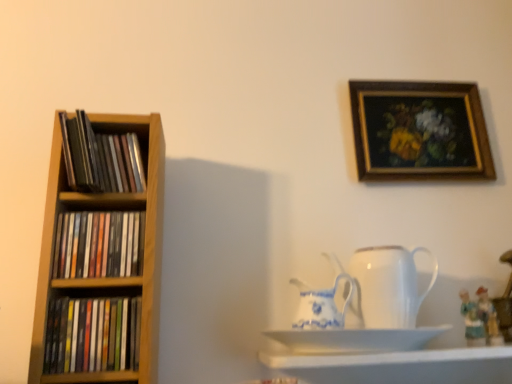
Question: Is matte ceramic figurine at lower right, which is the first toy in left-to-right order, oriented towards white porcelain jug at center, which is counted as the first jug, starting from the right?

Choices:
 (A) no
 (B) yes

Answer: (A)

Question: Is matte ceramic figurine at lower right, which is the first toy in left-to-right order, bigger than white porcelain jug at center, which is counted as the first jug, starting from the right?

Choices:
 (A) no
 (B) yes

Answer: (A)

Question: Does matte ceramic figurine at lower right, which is the second toy in right-to-left order, come behind white porcelain jug at center, positioned as the second jug in left-to-right order?

Choices:
 (A) no
 (B) yes

Answer: (B)

Question: Is matte ceramic figurine at lower right, which is the second toy in right-to-left order, shorter than white porcelain jug at center, which is counted as the first jug, starting from the right?

Choices:
 (A) yes
 (B) no

Answer: (A)

Question: From a real-world perspective, is matte ceramic figurine at lower right, which is the first toy in left-to-right order, physically below white porcelain jug at center, which is counted as the first jug, starting from the right?

Choices:
 (A) no
 (B) yes

Answer: (B)

Question: Based on their sizes in the image, would you say white glossy shelf at lower center is bigger or smaller than matte ceramic figurine at lower right, placed as the first toy when sorted from right to left?

Choices:
 (A) small
 (B) big

Answer: (B)

Question: Considering the positions of point (470, 382) and point (486, 324), is point (470, 382) closer or farther from the camera than point (486, 324)?

Choices:
 (A) farther
 (B) closer

Answer: (B)

Question: In terms of width, does white glossy shelf at lower center look wider or thinner when compared to matte ceramic figurine at lower right, which appears as the 2th toy when viewed from the left?

Choices:
 (A) wide
 (B) thin

Answer: (A)

Question: In the image, is white glossy shelf at lower center on the left side or the right side of matte ceramic figurine at lower right, which appears as the 2th toy when viewed from the left?

Choices:
 (A) right
 (B) left

Answer: (B)

Question: From the image's perspective, relative to white glossy shelf at lower center, is matte ceramic figurine at lower right, which appears as the 2th toy when viewed from the left, above or below?

Choices:
 (A) above
 (B) below

Answer: (A)

Question: Is matte ceramic figurine at lower right, which appears as the 2th toy when viewed from the left, taller or shorter than white glossy shelf at lower center?

Choices:
 (A) tall
 (B) short

Answer: (A)

Question: In terms of width, does matte ceramic figurine at lower right, placed as the first toy when sorted from right to left, look wider or thinner when compared to white glossy shelf at lower center?

Choices:
 (A) wide
 (B) thin

Answer: (B)

Question: Is point (478, 294) positioned closer to the camera than point (462, 349)?

Choices:
 (A) closer
 (B) farther

Answer: (B)

Question: Relative to matte ceramic figurine at lower right, which appears as the 2th toy when viewed from the left, is matte wooden shelf at left, the 2th book when ordered from bottom to top, in front or behind?

Choices:
 (A) front
 (B) behind

Answer: (A)

Question: Is matte wooden shelf at left, the 2th book when ordered from bottom to top, inside or outside of matte ceramic figurine at lower right, which appears as the 2th toy when viewed from the left?

Choices:
 (A) outside
 (B) inside

Answer: (A)